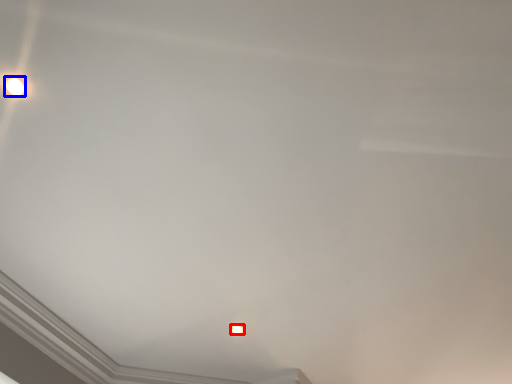
Question: Which object is closer to the camera taking this photo, lamp (highlighted by a red box) or lamp (highlighted by a blue box)?

Choices:
 (A) lamp
 (B) lamp

Answer: (B)